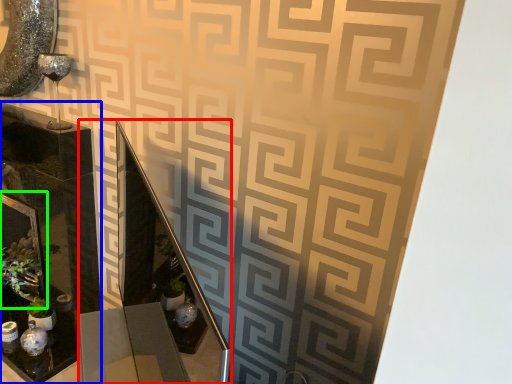
Question: Which object is the farthest from vanity (highlighted by a red box)? Choose among these: glass box (highlighted by a blue box) or picture frame (highlighted by a green box).

Choices:
 (A) glass box
 (B) picture frame

Answer: (B)